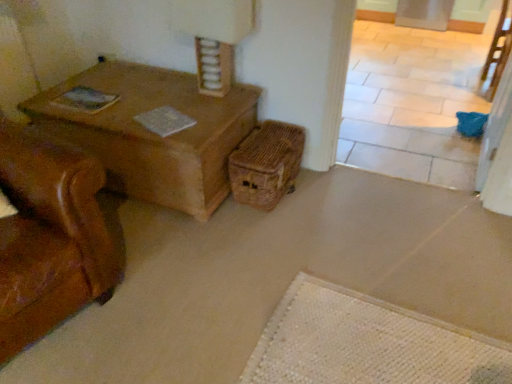
In order to click on woven brown basket at lower right in this screenshot , I will do `click(266, 164)`.

What do you see at coordinates (266, 164) in the screenshot? The height and width of the screenshot is (384, 512). I see `woven brown basket at lower right` at bounding box center [266, 164].

Measure the distance between point (x=241, y=183) and camera.

Point (x=241, y=183) and camera are 7.36 feet apart.

What do you see at coordinates (499, 49) in the screenshot? I see `brown woven chair at upper right` at bounding box center [499, 49].

You are a GUI agent. You are given a task and a screenshot of the screen. Output one action in this format:
    pyautogui.click(x=<x>, y=<y>)
    Task: Click on the brown woven chair at upper right
    The height and width of the screenshot is (384, 512).
    Given the screenshot: What is the action you would take?
    pyautogui.click(x=499, y=49)

I want to click on woven brown basket at lower right, so click(x=266, y=164).

Is woven brown basket at lower right to the right of brown woven chair at upper right from the viewer's perspective?

In fact, woven brown basket at lower right is to the left of brown woven chair at upper right.

Is woven brown basket at lower right positioned in front of brown woven chair at upper right?

Yes.

Which is farther from the camera, (271,153) or (500,33)?

The point (500,33) is farther from the camera.

From the image's perspective, does woven brown basket at lower right appear higher than brown woven chair at upper right?

No, from the image's perspective, woven brown basket at lower right is not above brown woven chair at upper right.

From a real-world perspective, is woven brown basket at lower right beneath brown woven chair at upper right?

Correct, in the physical world, woven brown basket at lower right is lower than brown woven chair at upper right.

Which of these two, woven brown basket at lower right or brown woven chair at upper right, is thinner?

brown woven chair at upper right is thinner.

Does woven brown basket at lower right have a greater height compared to brown woven chair at upper right?

Incorrect, the height of woven brown basket at lower right is not larger of that of brown woven chair at upper right.

Is woven brown basket at lower right bigger than brown woven chair at upper right?

No.

Based on the photo, is woven brown basket at lower right surrounding brown woven chair at upper right?

No, woven brown basket at lower right does not contain brown woven chair at upper right.

Is woven brown basket at lower right beside brown woven chair at upper right?

No, woven brown basket at lower right is not with brown woven chair at upper right.

Is woven brown basket at lower right facing towards brown woven chair at upper right?

No, woven brown basket at lower right is not aimed at brown woven chair at upper right.

From the picture: How different are the orientations of woven brown basket at lower right and brown woven chair at upper right in degrees?

The facing directions of woven brown basket at lower right and brown woven chair at upper right are 0.797 degrees apart.

How distant is woven brown basket at lower right from brown woven chair at upper right?

A distance of 2.06 meters exists between woven brown basket at lower right and brown woven chair at upper right.

The height and width of the screenshot is (384, 512). In the image, there is a brown woven chair at upper right. Identify the location of crate below it (from a real-world perspective). (266, 164).

Considering the positions of objects brown woven chair at upper right and woven brown basket at lower right in the image provided, who is more to the right, brown woven chair at upper right or woven brown basket at lower right?

→ From the viewer's perspective, brown woven chair at upper right appears more on the right side.

Between brown woven chair at upper right and woven brown basket at lower right, which one is positioned behind?

brown woven chair at upper right is behind.

Does point (490, 52) appear closer or farther from the camera than point (234, 170)?

Point (490, 52) is farther from the camera than point (234, 170).

From the image's perspective, is brown woven chair at upper right located above or below woven brown basket at lower right?

brown woven chair at upper right is above woven brown basket at lower right.

From a real-world perspective, between brown woven chair at upper right and woven brown basket at lower right, who is vertically higher?

brown woven chair at upper right is physically above.

Between brown woven chair at upper right and woven brown basket at lower right, which one has larger width?

Wider between the two is woven brown basket at lower right.

Does brown woven chair at upper right have a greater height compared to woven brown basket at lower right?

Correct, brown woven chair at upper right is much taller as woven brown basket at lower right.

Is brown woven chair at upper right smaller than woven brown basket at lower right?

No, brown woven chair at upper right is not smaller than woven brown basket at lower right.

Is brown woven chair at upper right completely or partially outside of woven brown basket at lower right?

Yes, brown woven chair at upper right is outside of woven brown basket at lower right.

From the picture: Are brown woven chair at upper right and woven brown basket at lower right located far from each other?

brown woven chair at upper right is positioned a significant distance from woven brown basket at lower right.

Looking at this image, is brown woven chair at upper right looking in the opposite direction of woven brown basket at lower right?

No.

How far apart are brown woven chair at upper right and woven brown basket at lower right?

6.75 feet.

Find the location of a particular element. The width and height of the screenshot is (512, 384). chair behind the woven brown basket at lower right is located at coordinates (499, 49).

This screenshot has height=384, width=512. Find the location of `chair above the woven brown basket at lower right (from a real-world perspective)`. chair above the woven brown basket at lower right (from a real-world perspective) is located at coordinates (499, 49).

You are a GUI agent. You are given a task and a screenshot of the screen. Output one action in this format:
    pyautogui.click(x=<x>, y=<y>)
    Task: Click on the chair behind the woven brown basket at lower right
    The image size is (512, 384).
    Given the screenshot: What is the action you would take?
    pyautogui.click(x=499, y=49)